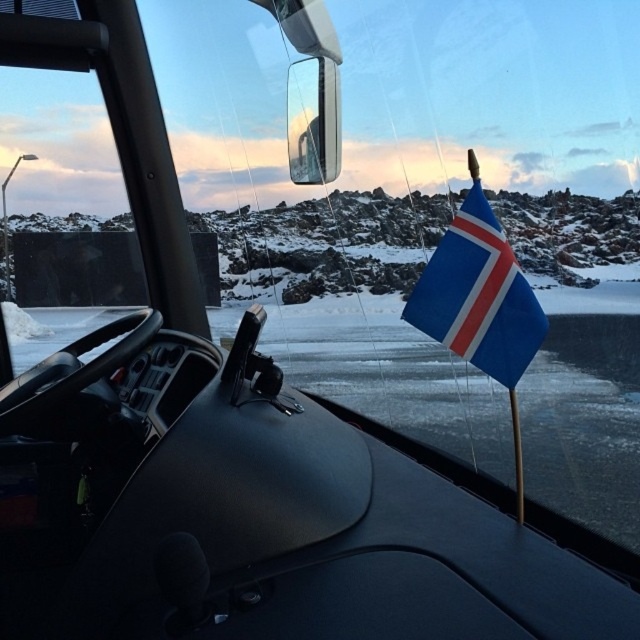
Question: Can you confirm if blue fabric flag at center is wider than glossy plastic view mirror at upper center?

Choices:
 (A) yes
 (B) no

Answer: (A)

Question: Which of the following is the farthest from the observer?

Choices:
 (A) (308, 76)
 (B) (477, 184)

Answer: (A)

Question: Is blue fabric flag at center above glossy plastic view mirror at upper center?

Choices:
 (A) yes
 (B) no

Answer: (B)

Question: Which point is closer to the camera taking this photo?

Choices:
 (A) (483, 320)
 (B) (301, 109)

Answer: (A)

Question: Does blue fabric flag at center have a larger size compared to glossy plastic view mirror at upper center?

Choices:
 (A) yes
 (B) no

Answer: (B)